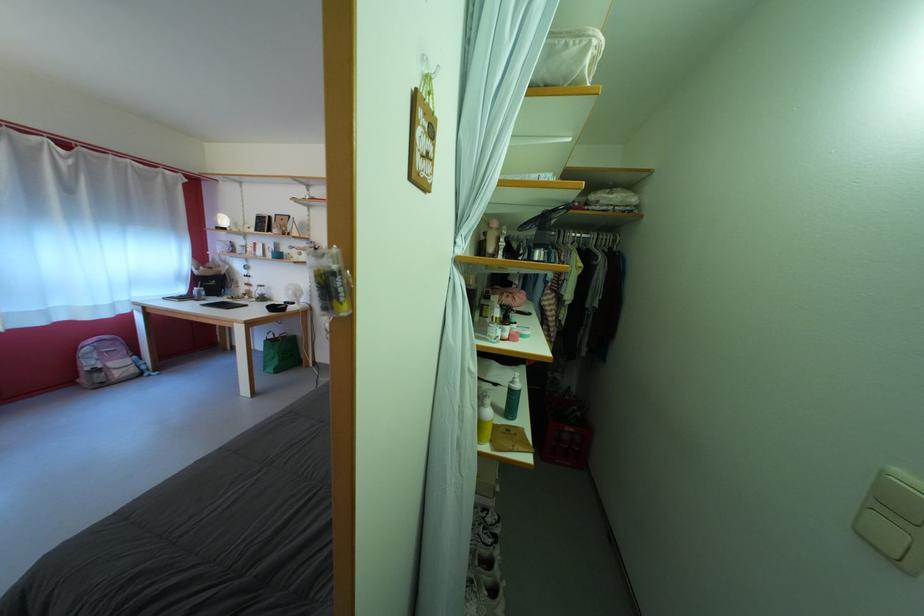
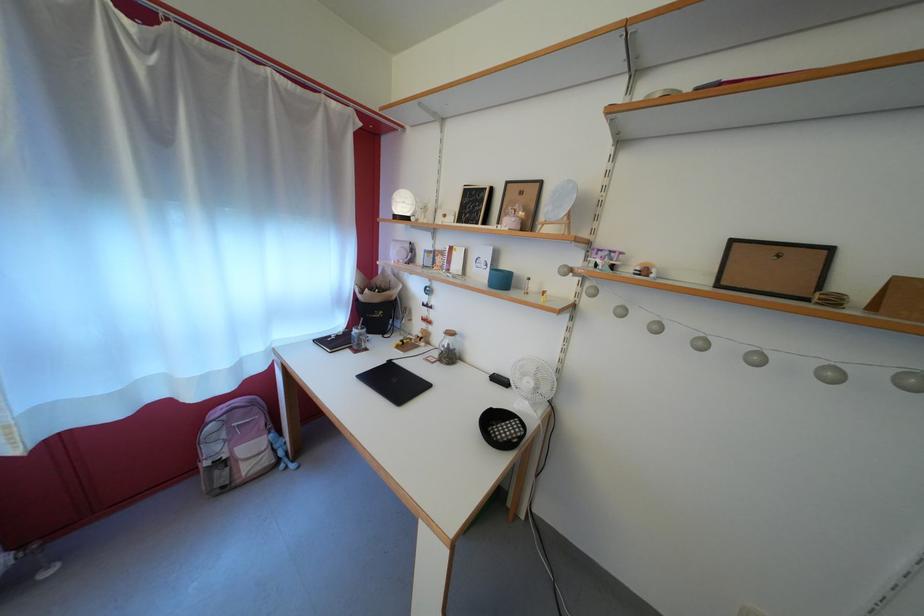
Which direction would the cameraman need to move to produce the second image?

The movement direction of the cameraman is left, forward.